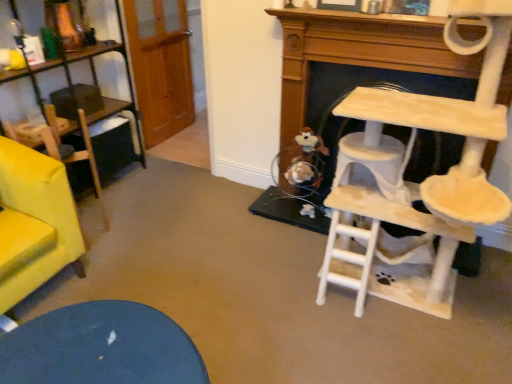
You are a GUI agent. You are given a task and a screenshot of the screen. Output one action in this format:
    pyautogui.click(x=<x>, y=<y>)
    Task: Click on the vacant space behind velvet yellow armchair at left
    
    Given the screenshot: What is the action you would take?
    pyautogui.click(x=110, y=208)